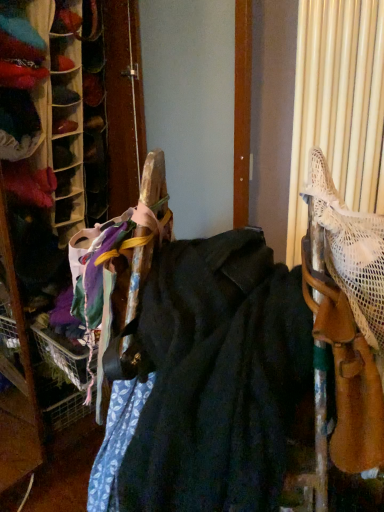
Question: Which direction should I rotate to look at velvet-like fabric at center, which ranks as the 1th wide in left-to-right order, — up or down?

Choices:
 (A) down
 (B) up

Answer: (A)

Question: Is white mesh bag at right, the 2th wide in the left-to-right sequence, in contact with velvet-like fabric at center, the 2th wide positioned from the right?

Choices:
 (A) yes
 (B) no

Answer: (B)

Question: From the image's perspective, is white mesh bag at right, the 2th wide in the left-to-right sequence, above velvet-like fabric at center, which ranks as the 1th wide in left-to-right order?

Choices:
 (A) yes
 (B) no

Answer: (A)

Question: Is white mesh bag at right, the first wide from the right, to the right of velvet-like fabric at center, the 2th wide positioned from the right, from the viewer's perspective?

Choices:
 (A) no
 (B) yes

Answer: (B)

Question: Does white mesh bag at right, the first wide from the right, have a smaller size compared to velvet-like fabric at center, the 2th wide positioned from the right?

Choices:
 (A) no
 (B) yes

Answer: (B)

Question: Can you confirm if white mesh bag at right, the 2th wide in the left-to-right sequence, is taller than velvet-like fabric at center, the 2th wide positioned from the right?

Choices:
 (A) yes
 (B) no

Answer: (B)

Question: Can you confirm if white mesh bag at right, the first wide from the right, is bigger than velvet-like fabric at center, which ranks as the 1th wide in left-to-right order?

Choices:
 (A) yes
 (B) no

Answer: (B)

Question: From a real-world perspective, does velvet-like fabric at center, the 2th wide positioned from the right, sit lower than white mesh bag at right, the first wide from the right?

Choices:
 (A) yes
 (B) no

Answer: (A)

Question: Considering the relative sizes of velvet-like fabric at center, the 2th wide positioned from the right, and white mesh bag at right, the first wide from the right, in the image provided, is velvet-like fabric at center, the 2th wide positioned from the right, taller than white mesh bag at right, the first wide from the right,?

Choices:
 (A) no
 (B) yes

Answer: (B)

Question: Is velvet-like fabric at center, the 2th wide positioned from the right, closer to camera compared to white mesh bag at right, the 2th wide in the left-to-right sequence?

Choices:
 (A) yes
 (B) no

Answer: (A)

Question: Does velvet-like fabric at center, the 2th wide positioned from the right, have a larger size compared to white mesh bag at right, the first wide from the right?

Choices:
 (A) no
 (B) yes

Answer: (B)

Question: From the image's perspective, does velvet-like fabric at center, the 2th wide positioned from the right, appear higher than white mesh bag at right, the 2th wide in the left-to-right sequence?

Choices:
 (A) no
 (B) yes

Answer: (A)

Question: Is velvet-like fabric at center, which ranks as the 1th wide in left-to-right order, not near white mesh bag at right, the first wide from the right?

Choices:
 (A) yes
 (B) no

Answer: (B)

Question: Does point (306, 385) appear closer or farther from the camera than point (322, 181)?

Choices:
 (A) closer
 (B) farther

Answer: (A)